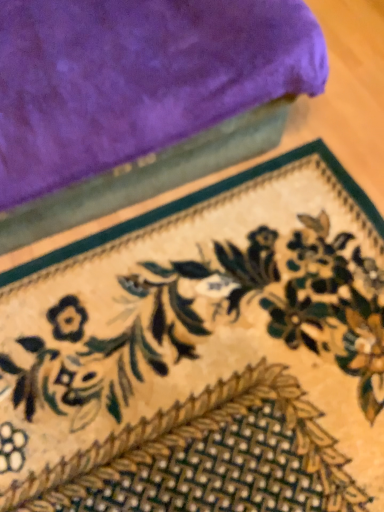
Question: Does velvet purple towel at upper left touch floral-patterned carpet at lower center?

Choices:
 (A) yes
 (B) no

Answer: (B)

Question: Would you say velvet purple towel at upper left contains floral-patterned carpet at lower center?

Choices:
 (A) no
 (B) yes

Answer: (A)

Question: Does velvet purple towel at upper left come in front of floral-patterned carpet at lower center?

Choices:
 (A) no
 (B) yes

Answer: (B)

Question: Is velvet purple towel at upper left looking in the opposite direction of floral-patterned carpet at lower center?

Choices:
 (A) no
 (B) yes

Answer: (A)

Question: From the image's perspective, is velvet purple towel at upper left located beneath floral-patterned carpet at lower center?

Choices:
 (A) no
 (B) yes

Answer: (A)

Question: Can you confirm if velvet purple towel at upper left is wider than floral-patterned carpet at lower center?

Choices:
 (A) yes
 (B) no

Answer: (B)

Question: Considering the relative sizes of floral-patterned carpet at lower center and velvet purple towel at upper left in the image provided, is floral-patterned carpet at lower center thinner than velvet purple towel at upper left?

Choices:
 (A) no
 (B) yes

Answer: (A)

Question: Is floral-patterned carpet at lower center next to velvet purple towel at upper left?

Choices:
 (A) yes
 (B) no

Answer: (B)

Question: Are floral-patterned carpet at lower center and velvet purple towel at upper left far apart?

Choices:
 (A) yes
 (B) no

Answer: (B)

Question: Does floral-patterned carpet at lower center appear on the left side of velvet purple towel at upper left?

Choices:
 (A) no
 (B) yes

Answer: (A)

Question: Is floral-patterned carpet at lower center to the right of velvet purple towel at upper left from the viewer's perspective?

Choices:
 (A) no
 (B) yes

Answer: (B)

Question: Can we say floral-patterned carpet at lower center lies outside velvet purple towel at upper left?

Choices:
 (A) yes
 (B) no

Answer: (A)

Question: Considering the positions of floral-patterned carpet at lower center and velvet purple towel at upper left in the image, is floral-patterned carpet at lower center bigger or smaller than velvet purple towel at upper left?

Choices:
 (A) small
 (B) big

Answer: (A)